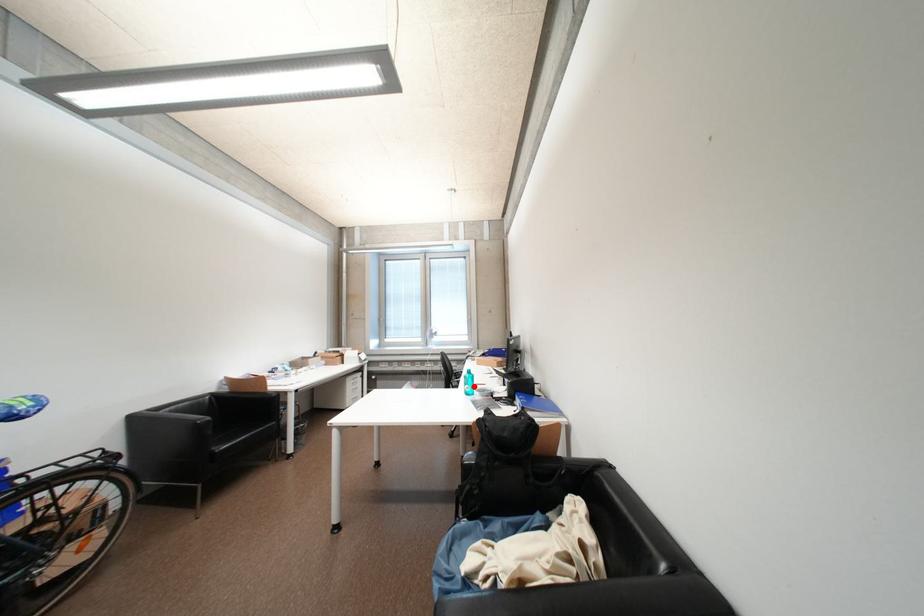
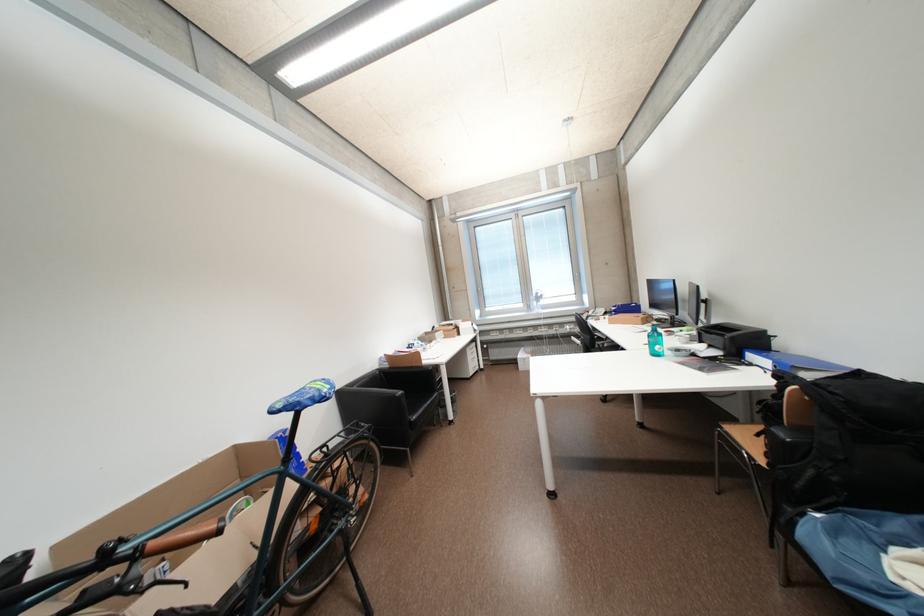
Question: A red point is marked in image1. In image2, is the corresponding 3D point closer to the camera or farther? Reply with the corresponding letter.

Choices:
 (A) The corresponding 3D point is closer.
 (B) The corresponding 3D point is farther.

Answer: (A)